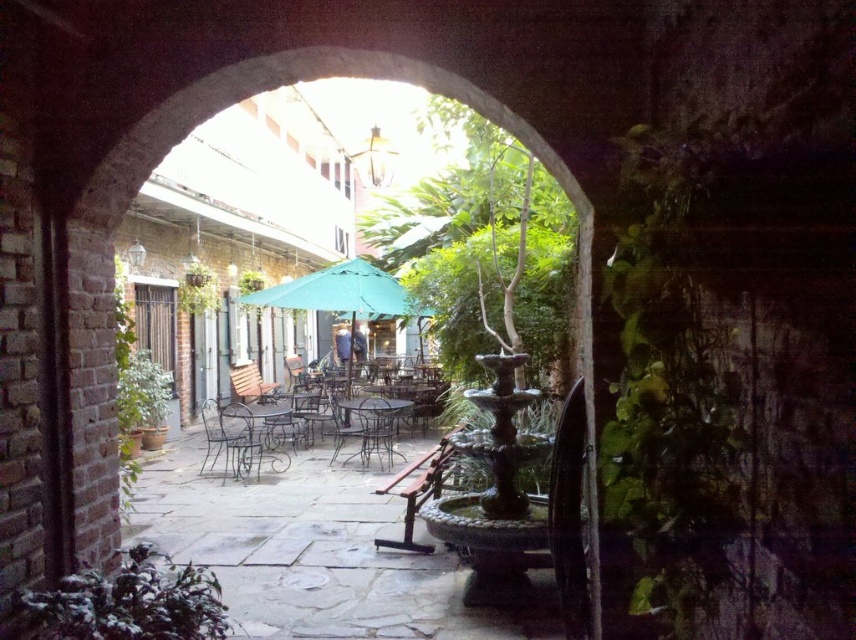
Question: Considering the real-world distances, which object is farthest from the brown wooden chair at center?

Choices:
 (A) metallic black chair at center
 (B) metallic silver chair at center
 (C) green fabric umbrella at center
 (D) metallic wrought iron table at center

Answer: (B)

Question: Does metallic wrought iron table at center appear on the left side of metallic wrought iron chair at center?

Choices:
 (A) yes
 (B) no

Answer: (A)

Question: Can you confirm if metallic wrought iron table at center is positioned to the right of brown wooden chair at center?

Choices:
 (A) yes
 (B) no

Answer: (B)

Question: Which of the following is the farthest from the observer?

Choices:
 (A) (342, 435)
 (B) (340, 406)
 (C) (367, 456)
 (D) (217, 404)

Answer: (D)

Question: Can you confirm if green fabric umbrella at center is wider than metallic wrought iron table at center?

Choices:
 (A) no
 (B) yes

Answer: (B)

Question: Which point is farther to the camera?

Choices:
 (A) (241, 403)
 (B) (364, 424)
 (C) (346, 412)
 (D) (412, 468)

Answer: (A)